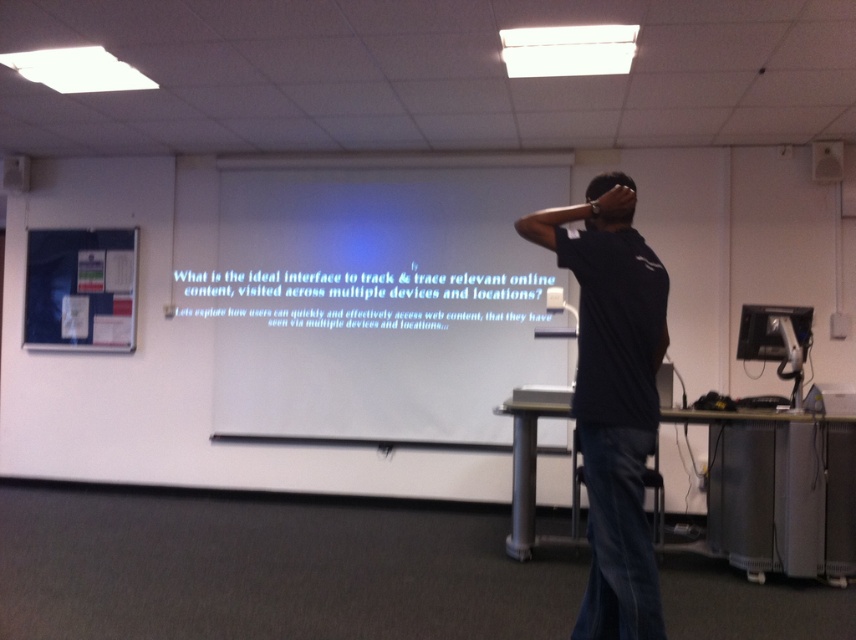
Question: Does white matte projection screen at center have a lesser width compared to black cotton shirt at center?

Choices:
 (A) yes
 (B) no

Answer: (B)

Question: Does black cotton shirt at center appear under black matte head at upper center?

Choices:
 (A) no
 (B) yes

Answer: (B)

Question: Which object appears closest to the camera in this image?

Choices:
 (A) blue fabric bulletin board at upper left
 (B) black matte head at upper center
 (C) black cotton shirt at center
 (D) matte black monitor at right

Answer: (C)

Question: Does black cotton shirt at center appear on the right side of matte black monitor at right?

Choices:
 (A) yes
 (B) no

Answer: (B)

Question: Which point is closer to the camera?

Choices:
 (A) (629, 209)
 (B) (46, 336)
 (C) (260, 237)

Answer: (A)

Question: Which of the following is the closest to the observer?

Choices:
 (A) (25, 289)
 (B) (409, 355)
 (C) (761, 349)
 (D) (625, 346)

Answer: (D)